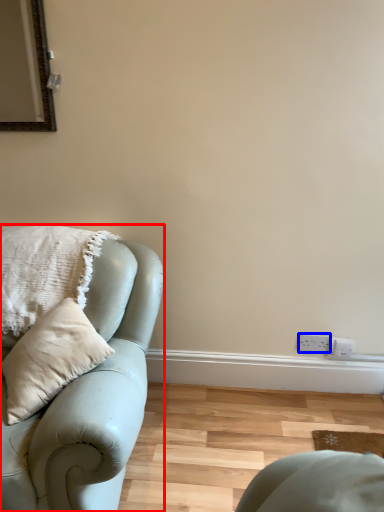
Question: Which object appears closest to the camera in this image, studio couch (highlighted by a red box) or electric outlet (highlighted by a blue box)?

Choices:
 (A) studio couch
 (B) electric outlet

Answer: (A)